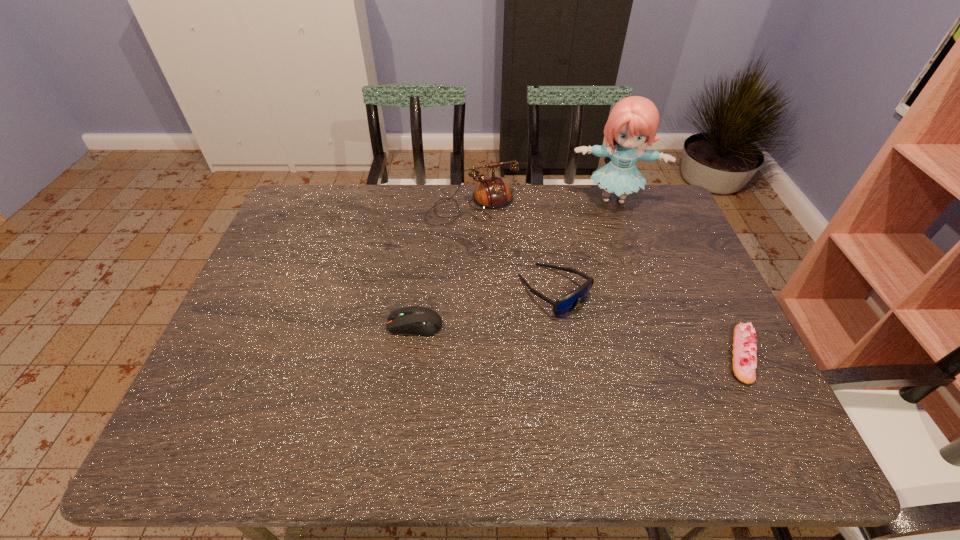
In the image, there is a desktop. Where is `free region at the near right corner`? This screenshot has height=540, width=960. free region at the near right corner is located at coordinates (753, 389).

Identify the location of empty location between the tallest object and the fourth shortest object. (543, 202).

At what (x,y) coordinates should I click in order to perform the action: click on blank region between the third tallest object and the computer equipment. Please return your answer as a coordinate pair (x, y). The height and width of the screenshot is (540, 960). Looking at the image, I should click on (485, 307).

Identify the location of free spot between the third shortest object and the fourth shortest object. (514, 248).

Find the location of `unoccupied position between the eclair and the second tallest object`. unoccupied position between the eclair and the second tallest object is located at coordinates (608, 280).

I want to click on vacant space in between the fourth shortest object and the computer equipment, so click(x=444, y=265).

Locate an element on the screen. The height and width of the screenshot is (540, 960). empty location between the telephone and the eclair is located at coordinates (608, 280).

The image size is (960, 540). Find the location of `free spot between the tallest object and the computer equipment`. free spot between the tallest object and the computer equipment is located at coordinates (515, 262).

At what (x,y) coordinates should I click in order to perform the action: click on vacant area between the telephone and the doll. Please return your answer as a coordinate pair (x, y). The width and height of the screenshot is (960, 540). Looking at the image, I should click on (543, 202).

Identify the location of vacant point located between the sunglasses and the computer equipment. This screenshot has width=960, height=540. (485, 307).